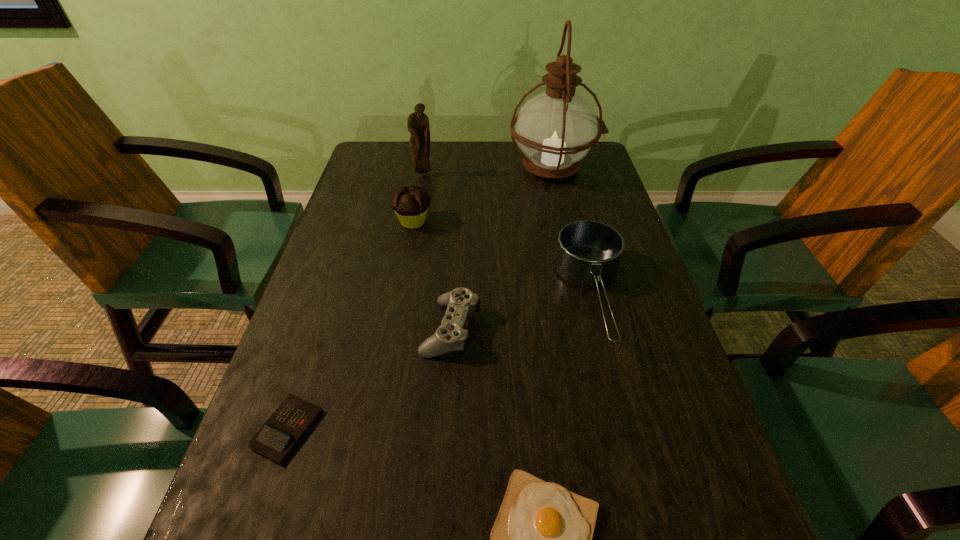
Where is `object at the far right corner`? object at the far right corner is located at coordinates (557, 128).

Locate an element on the screen. This screenshot has height=540, width=960. vacant space at the far edge of the desktop is located at coordinates (455, 158).

You are a GUI agent. You are given a task and a screenshot of the screen. Output one action in this format:
    pyautogui.click(x=<x>, y=<y>)
    Task: Click on the vacant space at the left edge
    The height and width of the screenshot is (540, 960).
    Given the screenshot: What is the action you would take?
    pyautogui.click(x=323, y=266)

In order to click on vacant space at the right edge of the desktop in this screenshot , I will do `click(677, 372)`.

Image resolution: width=960 pixels, height=540 pixels. In order to click on free region at the far left corner of the desktop in this screenshot , I will do `click(386, 180)`.

Find the location of a particular element. Image resolution: width=960 pixels, height=540 pixels. free space at the far right corner of the desktop is located at coordinates (595, 163).

You are a GUI agent. You are given a task and a screenshot of the screen. Output one action in this format:
    pyautogui.click(x=<x>, y=<y>)
    Task: Click on the free space between the tallest object and the third shortest object
    
    Given the screenshot: What is the action you would take?
    pyautogui.click(x=502, y=248)

Identify the location of free space between the control and the saucepan. This screenshot has width=960, height=540. (521, 313).

This screenshot has width=960, height=540. I want to click on free point between the second tallest object and the oil lamp, so click(489, 172).

Locate an element on the screen. The width and height of the screenshot is (960, 540). free space between the control and the saucepan is located at coordinates (521, 313).